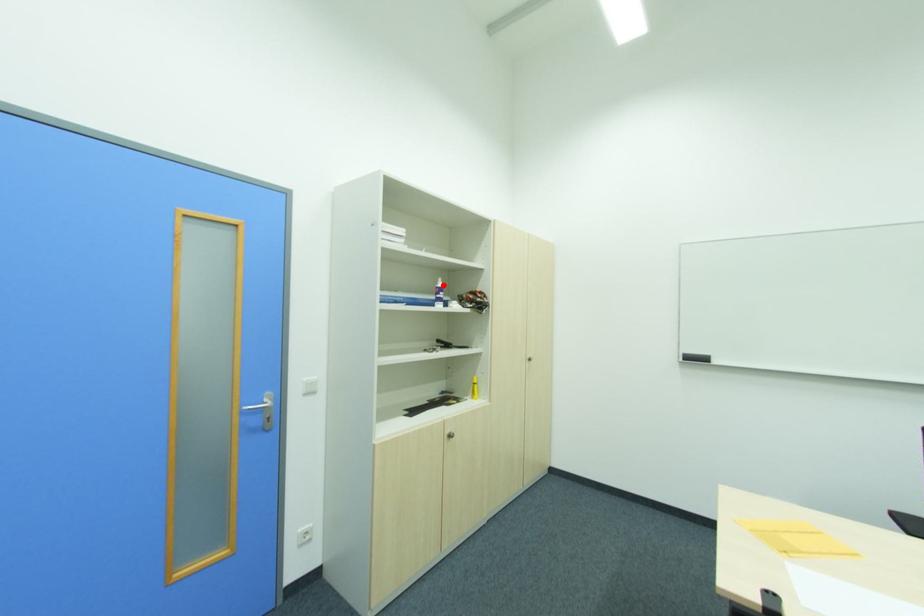
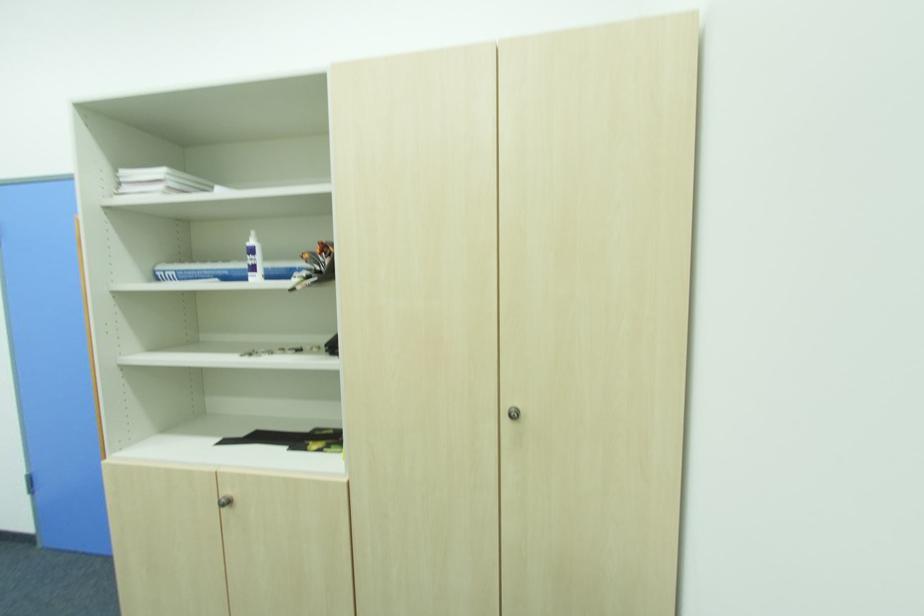
Locate, in the second image, the point that corresponds to the highlighted location in the first image.

(254, 243)